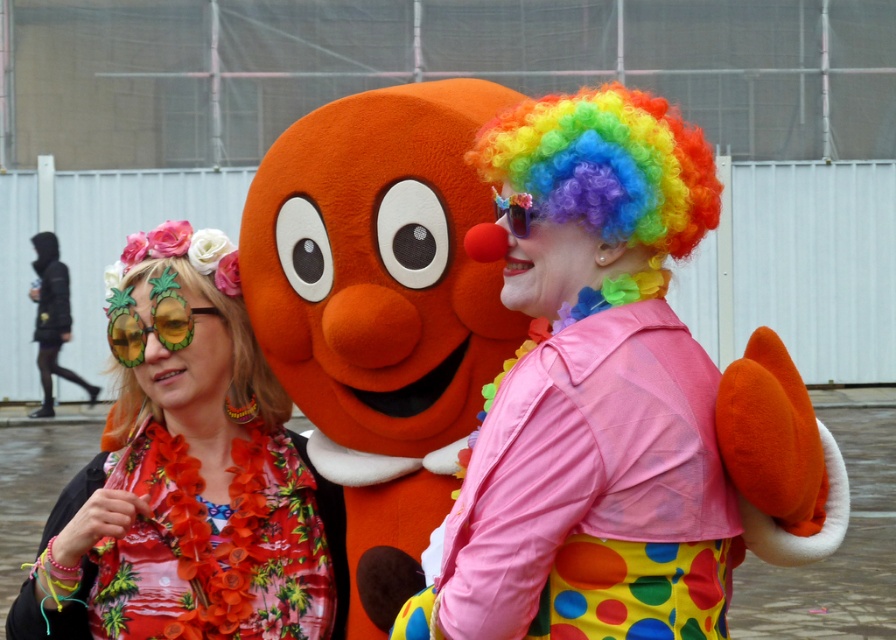
Question: Considering the relative positions of floral fabric lei at left and floral fabric wig at upper left in the image provided, where is floral fabric lei at left located with respect to floral fabric wig at upper left?

Choices:
 (A) below
 (B) above

Answer: (A)

Question: Which is farther from the floral fabric wig at upper left?

Choices:
 (A) shiny plastic sunglasses at center
 (B) yellowtransparentgoggles at left
 (C) floral fabric lei at left

Answer: (A)

Question: Which of these objects is positioned farthest from the floral fabric lei at left?

Choices:
 (A) shiny plastic sunglasses at center
 (B) rainbow wig at center
 (C) yellowtransparentgoggles at left

Answer: (A)

Question: Where is rainbow wig at center located in relation to floral fabric lei at left in the image?

Choices:
 (A) above
 (B) below

Answer: (A)

Question: Which of these objects is positioned closest to the rainbow wig at center?

Choices:
 (A) floral fabric lei at left
 (B) yellowtransparentgoggles at left

Answer: (A)

Question: Does floral fabric lei at left appear on the left side of floral fabric wig at upper left?

Choices:
 (A) no
 (B) yes

Answer: (A)